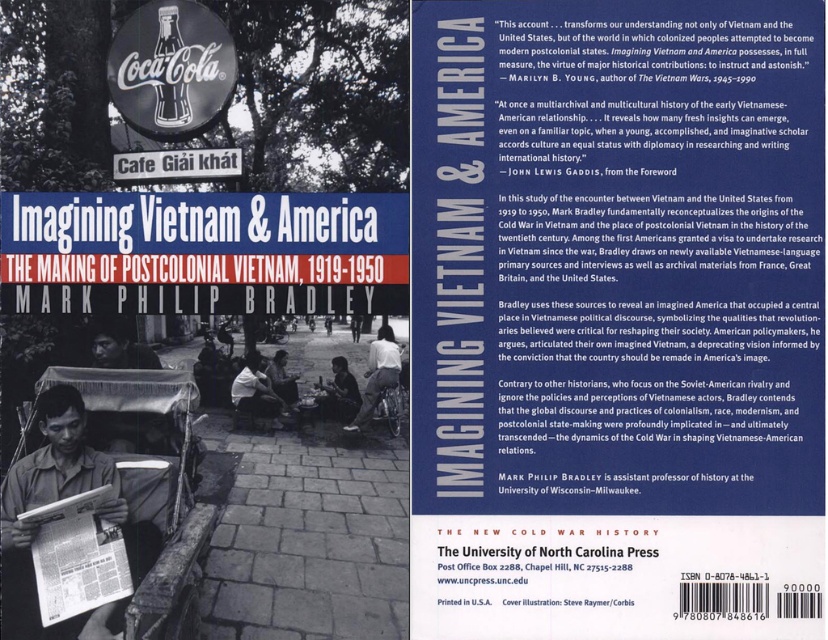
Between white paper magazine at center and dark brown leather bag at center, which one has less height?

white paper magazine at center is shorter.

Between white paper magazine at center and dark brown leather bag at center, which one is positioned lower?

dark brown leather bag at center is lower down.

Measure the distance between white paper magazine at center and camera.

The distance of white paper magazine at center from camera is 11.74 feet.

Identify the location of white paper magazine at center. The width and height of the screenshot is (828, 640). (76, 556).

Can you confirm if dark gray fabric skirt at center is shorter than dark blue shirt at center?

No.

Between dark gray fabric skirt at center and dark blue shirt at center, which one has more height?

With more height is dark gray fabric skirt at center.

Find the location of a particular element. This screenshot has height=640, width=828. dark gray fabric skirt at center is located at coordinates (378, 374).

Who is shorter, light brown wooden chair at center or dark blue shirt at center?

Standing shorter between the two is dark blue shirt at center.

Is light brown wooden chair at center to the right of dark blue shirt at center from the viewer's perspective?

In fact, light brown wooden chair at center is to the left of dark blue shirt at center.

This screenshot has width=828, height=640. I want to click on light brown wooden chair at center, so click(x=254, y=390).

Find the location of a particular element. Image resolution: width=828 pixels, height=640 pixels. light brown wooden chair at center is located at coordinates (254, 390).